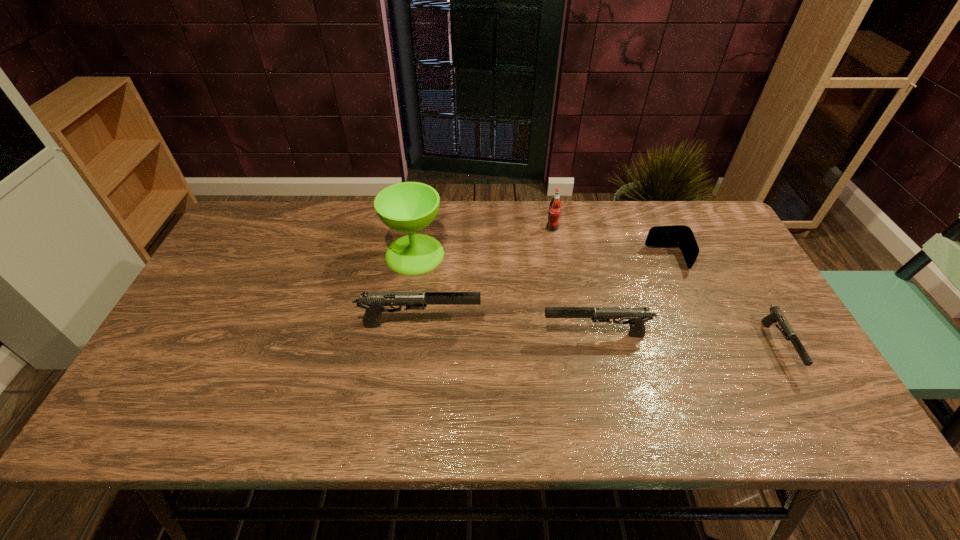
Identify the location of the leftmost gun. The width and height of the screenshot is (960, 540). (374, 302).

The image size is (960, 540). I want to click on the third shortest object, so click(637, 316).

I want to click on the second shortest gun, so click(637, 316).

Identify the location of the shortest gun. The width and height of the screenshot is (960, 540). (776, 314).

Locate an element on the screen. This screenshot has width=960, height=540. the shortest object is located at coordinates click(x=776, y=314).

Image resolution: width=960 pixels, height=540 pixels. Identify the location of the farthest object. (555, 206).

I want to click on the second tallest object, so tap(555, 206).

Identify the location of the second object from right to left. Image resolution: width=960 pixels, height=540 pixels. (680, 236).

This screenshot has height=540, width=960. Identify the location of wallet. (680, 236).

This screenshot has height=540, width=960. Identify the location of wineglass. (408, 207).